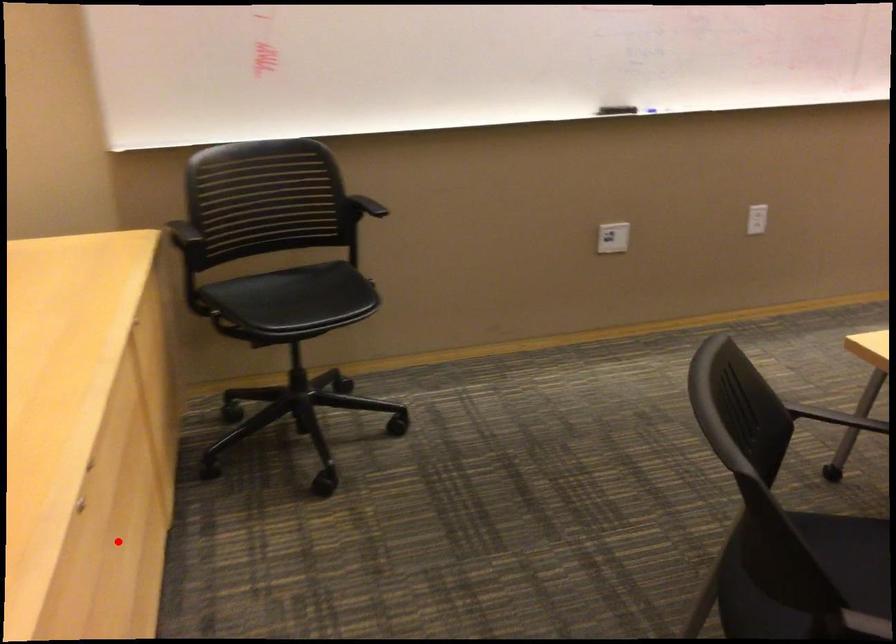
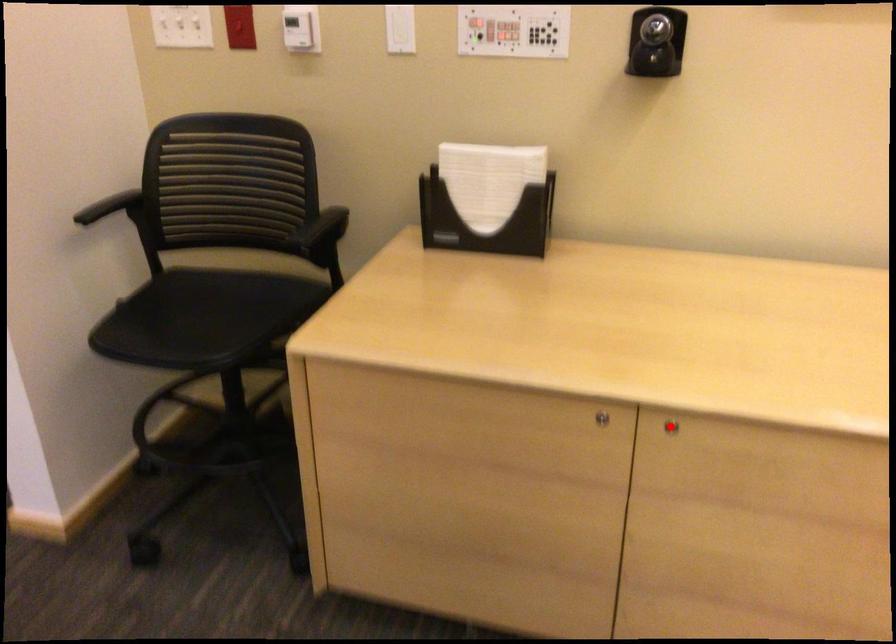
I am providing you with two images of the same scene from different viewpoints. A red point is marked on the first image and another point is marked on the second image. Is the marked point in image1 the same physical position as the marked point in image2?

Yes